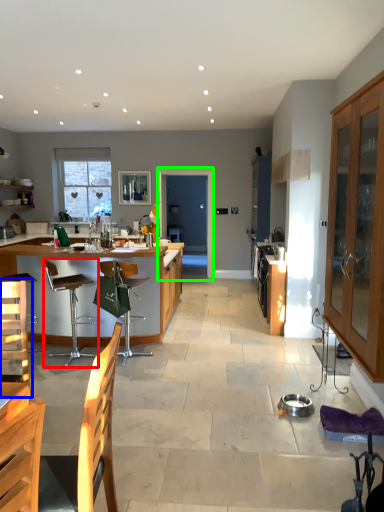
Question: Which is farther away from chair (highlighted by a red box)? armchair (highlighted by a blue box) or glass door (highlighted by a green box)?

Choices:
 (A) armchair
 (B) glass door

Answer: (B)